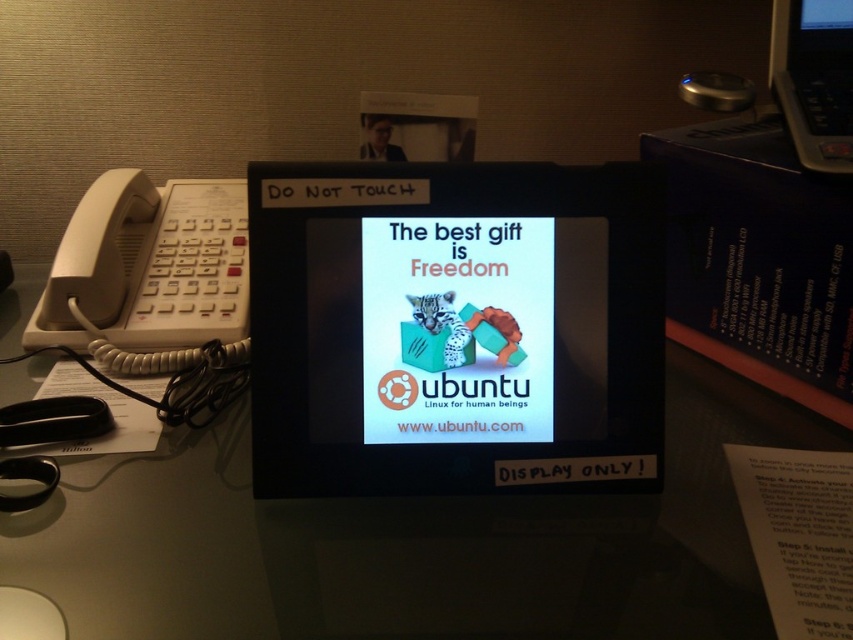
This screenshot has width=853, height=640. What do you see at coordinates (409, 544) in the screenshot?
I see `black glossy table at center` at bounding box center [409, 544].

Is black glossy table at center positioned at the back of white plastic phone at left?

No.

Which is in front, point (320, 612) or point (80, 209)?

Point (320, 612) is more forward.

Find the location of a particular element. black glossy table at center is located at coordinates (409, 544).

Does matte black monitor at center lie in front of black glossy table at center?

No, matte black monitor at center is further to the viewer.

Can you confirm if matte black monitor at center is wider than black glossy table at center?

No, matte black monitor at center is not wider than black glossy table at center.

Measure the distance between point (543, 451) and camera.

A distance of 18.73 inches exists between point (543, 451) and camera.

You are a GUI agent. You are given a task and a screenshot of the screen. Output one action in this format:
    pyautogui.click(x=<x>, y=<y>)
    Task: Click on the matte black monitor at center
    The height and width of the screenshot is (640, 853).
    Given the screenshot: What is the action you would take?
    pyautogui.click(x=456, y=328)

Can you confirm if matte black monitor at center is thinner than white plastic phone at left?

Incorrect, matte black monitor at center's width is not less than white plastic phone at left's.

In the scene shown: Who is positioned more to the right, matte black monitor at center or white plastic phone at left?

Positioned to the right is matte black monitor at center.

What are the coordinates of `matte black monitor at center` in the screenshot? It's located at (456, 328).